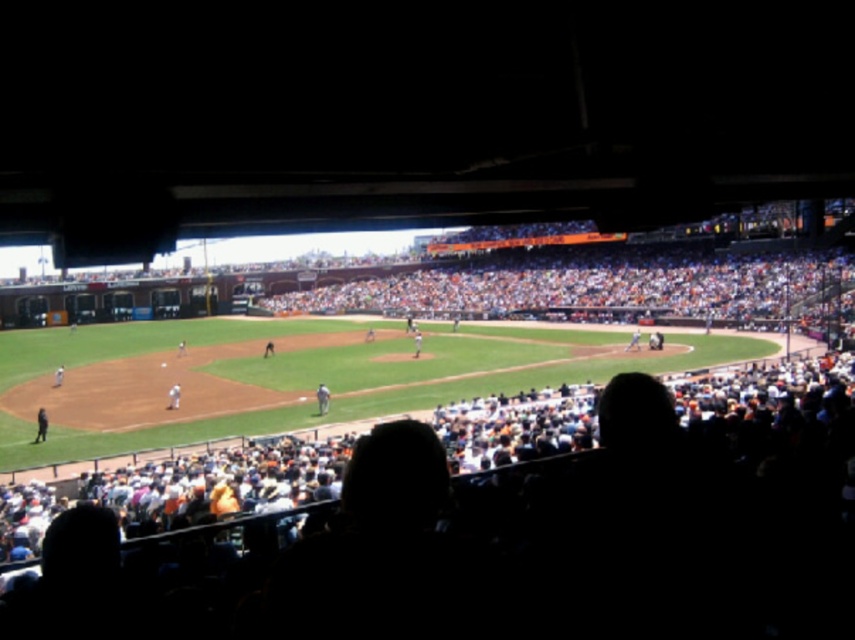
You are a spectator at the baseball game and want to take a photo of both the white uniformed player at center and the dark blue uniform at lower left. Which player should you pan your camera to first to capture them both in the frame?

You should pan your camera to the dark blue uniform at lower left first since the white uniformed player at center is to the right of it, allowing both to be captured in the frame by moving the camera from left to right.

You are a photographer standing at the edge of the baseball field. You want to take a closeup photo of the dark blue uniform at lower left. Considering the distance, will you need a zoom lens?

The dark blue uniform at lower left is 68.83 meters away from the camera. A zoom lens would be necessary to capture a closeup of the dark blue uniform at lower left from that distance.